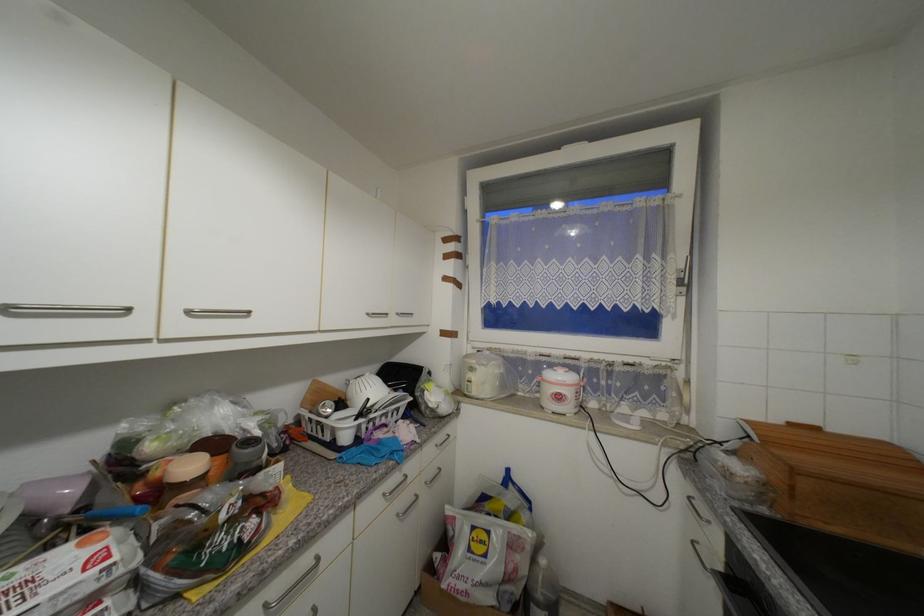
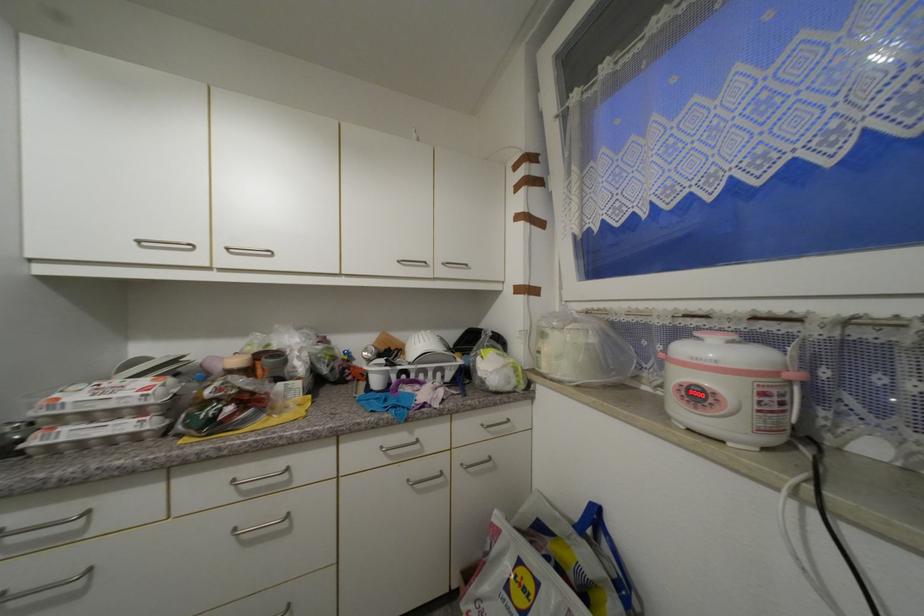
The point at (x=390, y=496) is marked in the first image. Where is the corresponding point in the second image?

(387, 448)